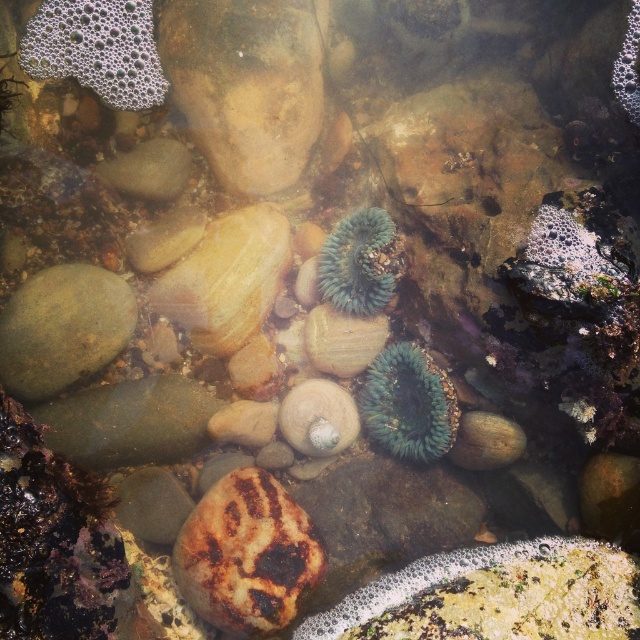
Question: Which point is farther to the camera?

Choices:
 (A) (369, 310)
 (B) (212, 531)
 (C) (410, 369)

Answer: (A)

Question: Observing the image, what is the correct spatial positioning of green fuzzy anemone at center in reference to teal fuzzy anemone at center?

Choices:
 (A) below
 (B) above

Answer: (A)

Question: Which object is closer to the camera taking this photo?

Choices:
 (A) teal fuzzy anemone at center
 (B) green smooth rock at left
 (C) brown textured rock at center

Answer: (C)

Question: Which object appears farthest from the camera in this image?

Choices:
 (A) green smooth rock at left
 (B) green fuzzy anemone at center
 (C) brown textured rock at center
 (D) teal fuzzy anemone at center

Answer: (D)

Question: Does green fuzzy anemone at center appear on the left side of teal fuzzy anemone at center?

Choices:
 (A) yes
 (B) no

Answer: (B)

Question: Can you confirm if green smooth rock at left is thinner than green fuzzy anemone at center?

Choices:
 (A) yes
 (B) no

Answer: (B)